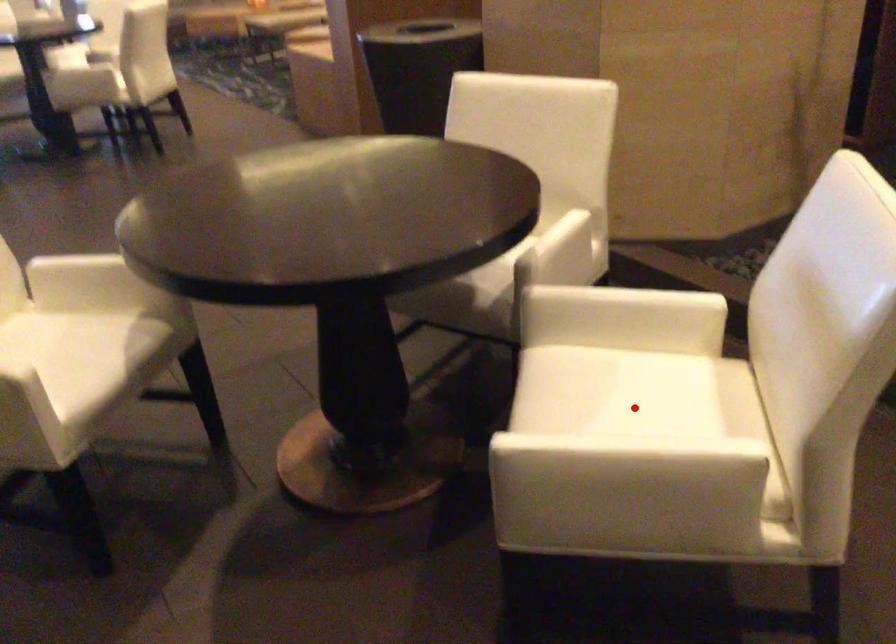
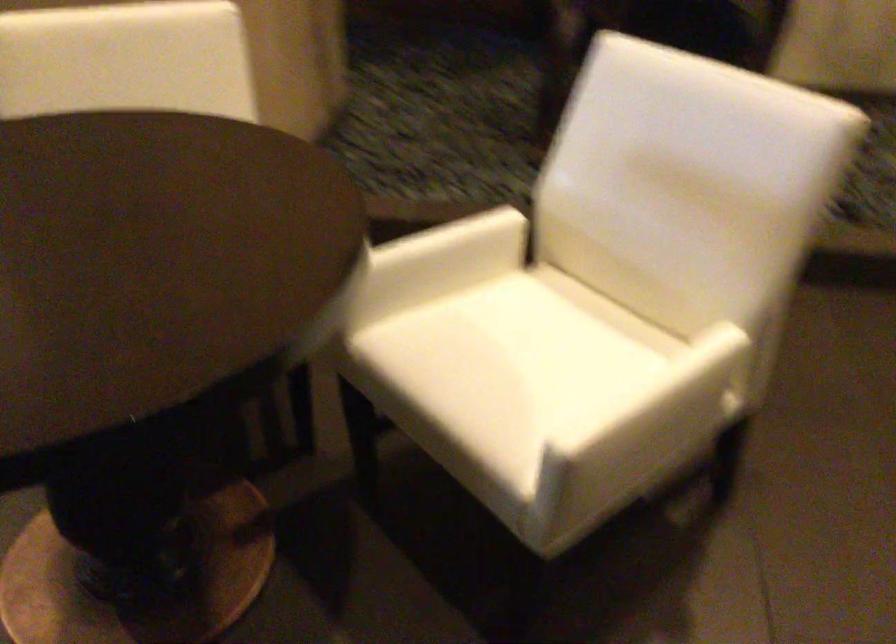
Question: I am providing you with two images of the same scene from different viewpoints. In image1, a red point is highlighted. Considering the same 3D point in image2, which of the following is correct?

Choices:
 (A) It is closer
 (B) It is farther

Answer: (A)